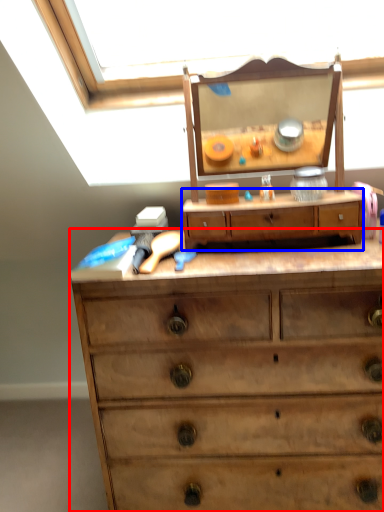
Question: Among these objects, which one is farthest to the camera, chest of drawers (highlighted by a red box) or drawer (highlighted by a blue box)?

Choices:
 (A) chest of drawers
 (B) drawer

Answer: (B)